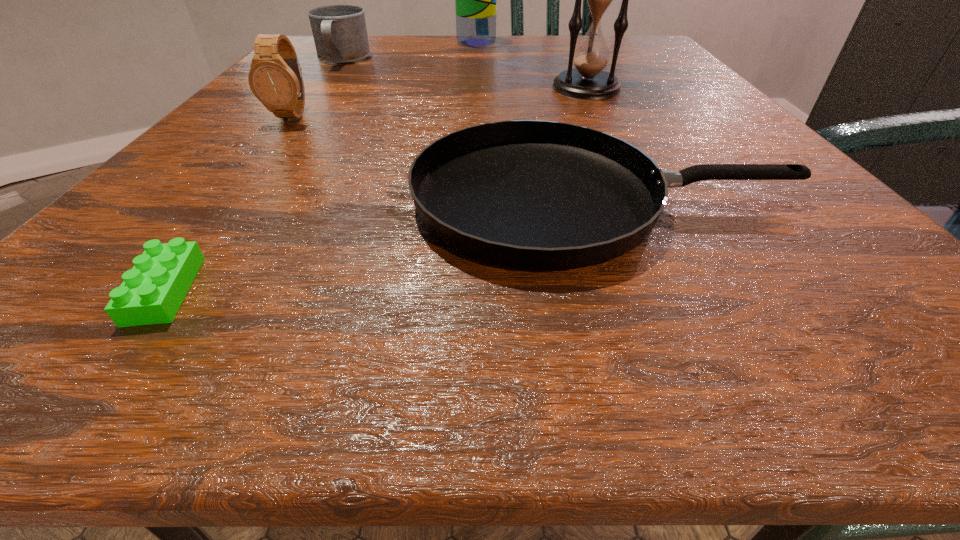
Where is `water bottle`? water bottle is located at coordinates coord(476,0).

The width and height of the screenshot is (960, 540). In order to click on the fourth nearest object in this screenshot , I will do `click(588, 81)`.

Identify the location of the third nearest object. (275, 78).

Locate an element on the screen. watch is located at coordinates (275, 78).

Find the location of a particular element. The image size is (960, 540). the second farthest object is located at coordinates (339, 31).

Locate an element on the screen. This screenshot has width=960, height=540. the third shortest object is located at coordinates (339, 31).

The image size is (960, 540). I want to click on the second shortest object, so click(536, 195).

This screenshot has width=960, height=540. I want to click on the shortest object, so click(152, 292).

Image resolution: width=960 pixels, height=540 pixels. Find the location of `vacant area situated 0.080m on the front label of the water bottle`. vacant area situated 0.080m on the front label of the water bottle is located at coordinates (531, 43).

Identify the location of vacant region located on the left of the fourth nearest object. [346, 87].